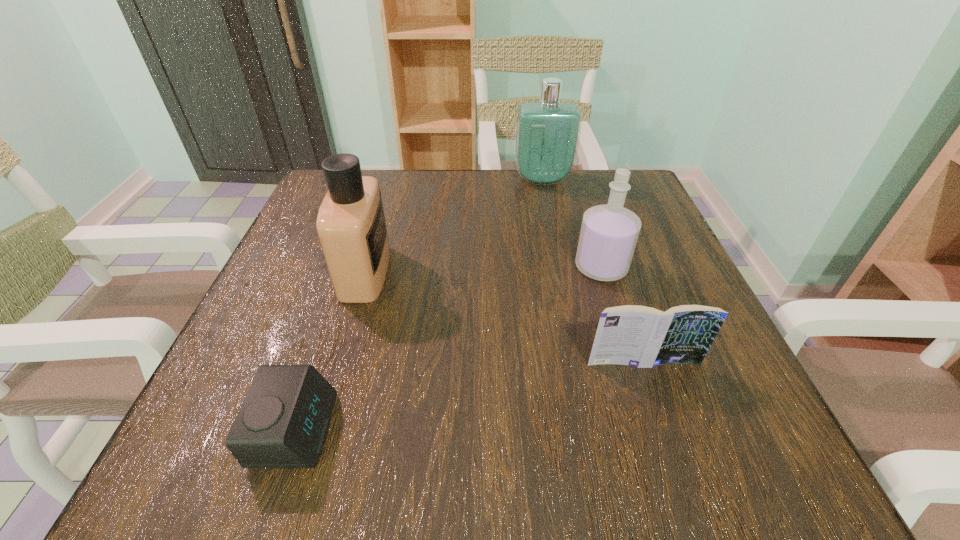
Locate an element on the screen. The width and height of the screenshot is (960, 540). the farthest object is located at coordinates (547, 133).

Identify the location of the leftmost perfume. The width and height of the screenshot is (960, 540). (351, 226).

Locate an element on the screen. The width and height of the screenshot is (960, 540). the second shortest object is located at coordinates (633, 335).

Identify the location of the fourth farthest object. This screenshot has width=960, height=540. (633, 335).

Where is `the nearest object`? The height and width of the screenshot is (540, 960). the nearest object is located at coordinates (283, 422).

Where is `alarm clock`? This screenshot has height=540, width=960. alarm clock is located at coordinates (283, 422).

The height and width of the screenshot is (540, 960). I want to click on vacant space positioned 0.290m on the front label of the farthest object, so click(560, 264).

I want to click on vacant space located on the front label of the leftmost perfume, so click(x=470, y=273).

Locate an element on the screen. The height and width of the screenshot is (540, 960). vacant region located on the front cover of the book is located at coordinates (660, 415).

Where is `blank space located on the front-facing side of the shortest object`? blank space located on the front-facing side of the shortest object is located at coordinates coord(592,430).